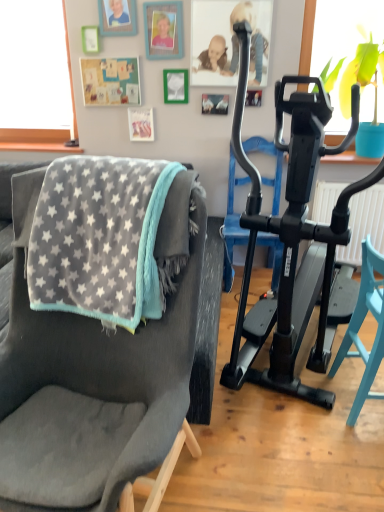
The width and height of the screenshot is (384, 512). What do you see at coordinates (101, 239) in the screenshot?
I see `gray fleece blanket at left` at bounding box center [101, 239].

In order to face soft gray fabric chair at left, placed as the second chair when sorted from right to left, should I rotate leftwards or rightwards?

Rotate your view left by about 14.786°.

At what (x,y) coordinates should I click in order to perform the action: click on black plastic stationary bicycle at right. Please return your answer as a coordinate pair (x, y). Looking at the image, I should click on (290, 237).

Identify the location of translucent glass window screen at upper right. This screenshot has width=384, height=512. (349, 56).

What is the approximate width of black rubber exercise machine at right?

black rubber exercise machine at right is 19.35 inches wide.

Identify the location of gray fleece blanket at left. The image size is (384, 512). (101, 239).

Consider the image. Is teal wood chair at right, the 2th chair from the left, shorter than gray fleece blanket at left?

Incorrect, the height of teal wood chair at right, the 2th chair from the left, does not fall short of that of gray fleece blanket at left.

Is teal wood chair at right, the 2th chair from the left, to the left or to the right of gray fleece blanket at left in the image?

teal wood chair at right, the 2th chair from the left, is positioned on gray fleece blanket at left's right side.

From a real-world perspective, is teal wood chair at right, the 2th chair from the left, physically above gray fleece blanket at left?

No, from a real-world perspective, teal wood chair at right, the 2th chair from the left, is not on top of gray fleece blanket at left.

Can we say black plastic stationary bicycle at right lies outside gray fleece blanket at left?

Indeed, black plastic stationary bicycle at right is completely outside gray fleece blanket at left.

Considering the positions of objects black plastic stationary bicycle at right and gray fleece blanket at left in the image provided, who is in front, black plastic stationary bicycle at right or gray fleece blanket at left?

Positioned in front is black plastic stationary bicycle at right.

Considering the relative positions of black plastic stationary bicycle at right and gray fleece blanket at left in the image provided, is black plastic stationary bicycle at right to the left or to the right of gray fleece blanket at left?

From the image, it's evident that black plastic stationary bicycle at right is to the right of gray fleece blanket at left.

From the image's perspective, is black plastic stationary bicycle at right located above gray fleece blanket at left?

Yes, from the image's perspective, black plastic stationary bicycle at right is over gray fleece blanket at left.

Does point (316, 74) lie behind point (300, 390)?

Yes, point (316, 74) is farther from viewer.

How many degrees apart are the facing directions of translucent glass window screen at upper right and black plastic stationary bicycle at right?

There is a 20.7-degree angle between the facing directions of translucent glass window screen at upper right and black plastic stationary bicycle at right.

Is translucent glass window screen at upper right far away from black plastic stationary bicycle at right?

Yes, translucent glass window screen at upper right is far from black plastic stationary bicycle at right.

Looking at their sizes, would you say translucent glass window screen at upper right is wider or thinner than black plastic stationary bicycle at right?

In the image, translucent glass window screen at upper right appears to be more narrow than black plastic stationary bicycle at right.

Is teal wood chair at right, marked as the first chair in a right-to-left arrangement, taller than black rubber exercise machine at right?

Incorrect, the height of teal wood chair at right, marked as the first chair in a right-to-left arrangement, is not larger of that of black rubber exercise machine at right.

Identify the location of armchair on the left of the teal wood chair at right, the 2th chair from the left. (232, 223).

Looking at this image, is teal wood chair at right, the 2th chair from the left, at the right side of black rubber exercise machine at right?

Yes, teal wood chair at right, the 2th chair from the left, is to the right of black rubber exercise machine at right.

Does teal wood chair at right, the 2th chair from the left, touch black plastic stationary bicycle at right?

There is a gap between teal wood chair at right, the 2th chair from the left, and black plastic stationary bicycle at right.

Is teal wood chair at right, the 2th chair from the left, smaller than black plastic stationary bicycle at right?

Yes, teal wood chair at right, the 2th chair from the left, is smaller than black plastic stationary bicycle at right.

What's the angular difference between teal wood chair at right, marked as the first chair in a right-to-left arrangement, and black plastic stationary bicycle at right's facing directions?

The angle between the facing direction of teal wood chair at right, marked as the first chair in a right-to-left arrangement, and the facing direction of black plastic stationary bicycle at right is 115 degrees.

Is teal wood chair at right, the 2th chair from the left, thinner than black plastic stationary bicycle at right?

Indeed, teal wood chair at right, the 2th chair from the left, has a lesser width compared to black plastic stationary bicycle at right.

Is point (243, 231) closer or farther from the camera than point (151, 453)?

Point (243, 231).

Considering the relative positions of black rubber exercise machine at right and soft gray fabric chair at left, placed as the second chair when sorted from right to left, in the image provided, is black rubber exercise machine at right behind soft gray fabric chair at left, placed as the second chair when sorted from right to left,?

Yes, it is.

Can you confirm if black rubber exercise machine at right is taller than soft gray fabric chair at left, the first chair when ordered from left to right?

Incorrect, the height of black rubber exercise machine at right is not larger of that of soft gray fabric chair at left, the first chair when ordered from left to right.

Between black rubber exercise machine at right and soft gray fabric chair at left, placed as the second chair when sorted from right to left, which one has smaller width?

black rubber exercise machine at right is thinner.

Is translucent glass window screen at upper right at the left side of black rubber exercise machine at right?

In fact, translucent glass window screen at upper right is to the right of black rubber exercise machine at right.

Considering the points (360, 74) and (227, 254), which point is in front, point (360, 74) or point (227, 254)?

The point (227, 254) is closer to the camera.

Considering their positions, is translucent glass window screen at upper right located in front of or behind black rubber exercise machine at right?

Visually, translucent glass window screen at upper right is located in front of black rubber exercise machine at right.

Where is `chair behind the gray fleece blanket at left`? chair behind the gray fleece blanket at left is located at coordinates (360, 326).

The image size is (384, 512). I want to click on stationary bicycle below the gray fleece blanket at left (from a real-world perspective), so click(x=290, y=237).

Looking at the image, which one is located further to black plastic stationary bicycle at right, smooth skin baby at upper center or teal wood chair at right, the 2th chair from the left?

smooth skin baby at upper center lies further to black plastic stationary bicycle at right than the other object.

When comparing their distances from smooth skin baby at upper center, does translucent glass window screen at upper right or gray fleece blanket at left seem closer?

translucent glass window screen at upper right is closer to smooth skin baby at upper center.

Considering their positions, is translucent glass window screen at upper right positioned closer to soft gray fabric chair at left, the first chair when ordered from left to right, than teal wood chair at right, marked as the first chair in a right-to-left arrangement?

teal wood chair at right, marked as the first chair in a right-to-left arrangement.

Estimate the real-world distances between objects in this image. Which object is closer to teal wood chair at right, the 2th chair from the left, soft gray fabric chair at left, placed as the second chair when sorted from right to left, or translucent glass window screen at upper right?

soft gray fabric chair at left, placed as the second chair when sorted from right to left, is positioned closer to the anchor teal wood chair at right, the 2th chair from the left.

Considering their positions, is black rubber exercise machine at right positioned closer to black plastic stationary bicycle at right than teal wood chair at right, marked as the first chair in a right-to-left arrangement?

teal wood chair at right, marked as the first chair in a right-to-left arrangement.

From the image, which object appears to be nearer to smooth skin baby at upper center, gray fleece blanket at left or teal wood chair at right, the 2th chair from the left?

teal wood chair at right, the 2th chair from the left.

Based on their spatial positions, is smooth skin baby at upper center or black rubber exercise machine at right closer to gray fleece blanket at left?

Among the two, black rubber exercise machine at right is located nearer to gray fleece blanket at left.

From the image, which object appears to be farther from soft gray fabric chair at left, the first chair when ordered from left to right, smooth skin baby at upper center or black plastic stationary bicycle at right?

Among the two, smooth skin baby at upper center is located further to soft gray fabric chair at left, the first chair when ordered from left to right.

Identify the location of armchair between soft gray fabric chair at left, the first chair when ordered from left to right, and smooth skin baby at upper center from front to back. (232, 223).

Where is `chair between soft gray fabric chair at left, placed as the second chair when sorted from right to left, and black rubber exercise machine at right in the front-back direction`? The height and width of the screenshot is (512, 384). chair between soft gray fabric chair at left, placed as the second chair when sorted from right to left, and black rubber exercise machine at right in the front-back direction is located at coordinates (360, 326).

Where is `chair between smooth skin baby at upper center and soft gray fabric chair at left, the first chair when ordered from left to right, in the vertical direction`? The width and height of the screenshot is (384, 512). chair between smooth skin baby at upper center and soft gray fabric chair at left, the first chair when ordered from left to right, in the vertical direction is located at coordinates (360, 326).

Where is `stationary bicycle that lies between translucent glass window screen at upper right and teal wood chair at right, marked as the first chair in a right-to-left arrangement, from top to bottom`? stationary bicycle that lies between translucent glass window screen at upper right and teal wood chair at right, marked as the first chair in a right-to-left arrangement, from top to bottom is located at coordinates (290, 237).